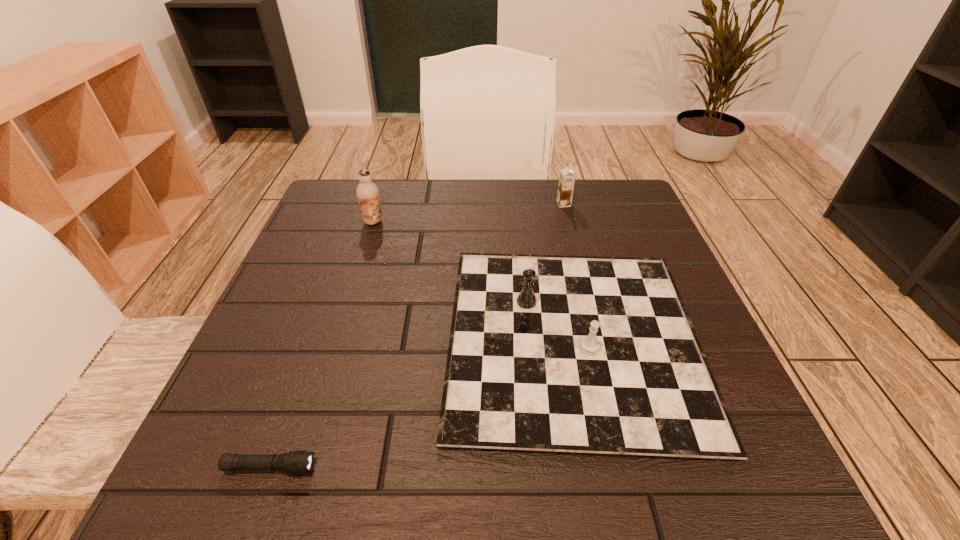
Identify the location of gameboard at the near edge. The height and width of the screenshot is (540, 960). (594, 355).

You are a GUI agent. You are given a task and a screenshot of the screen. Output one action in this format:
    pyautogui.click(x=<x>, y=<y>)
    Task: Click on the flashlight that is at the near edge
    The image size is (960, 540).
    Given the screenshot: What is the action you would take?
    pyautogui.click(x=296, y=462)

Locate an element on the screen. This screenshot has width=960, height=540. chocolate milk positioned at the left edge is located at coordinates (367, 192).

At what (x,y) coordinates should I click in order to perform the action: click on flashlight at the left edge. Please return your answer as a coordinate pair (x, y). The height and width of the screenshot is (540, 960). Looking at the image, I should click on (296, 462).

Where is `object positioned at the right edge`? The width and height of the screenshot is (960, 540). object positioned at the right edge is located at coordinates (594, 355).

Locate an element on the screen. object that is at the far left corner is located at coordinates (367, 192).

Where is `object that is at the near left corner`? object that is at the near left corner is located at coordinates (296, 462).

You are a GUI agent. You are given a task and a screenshot of the screen. Output one action in this format:
    pyautogui.click(x=<x>, y=<y>)
    Task: Click on the object that is at the near right corner
    Image resolution: width=960 pixels, height=540 pixels.
    Given the screenshot: What is the action you would take?
    pyautogui.click(x=594, y=355)

Identify the location of free space at the far edge of the desktop. This screenshot has width=960, height=540. (437, 227).

What are the coordinates of `vacant region at the near edge of the desktop` in the screenshot? It's located at (415, 454).